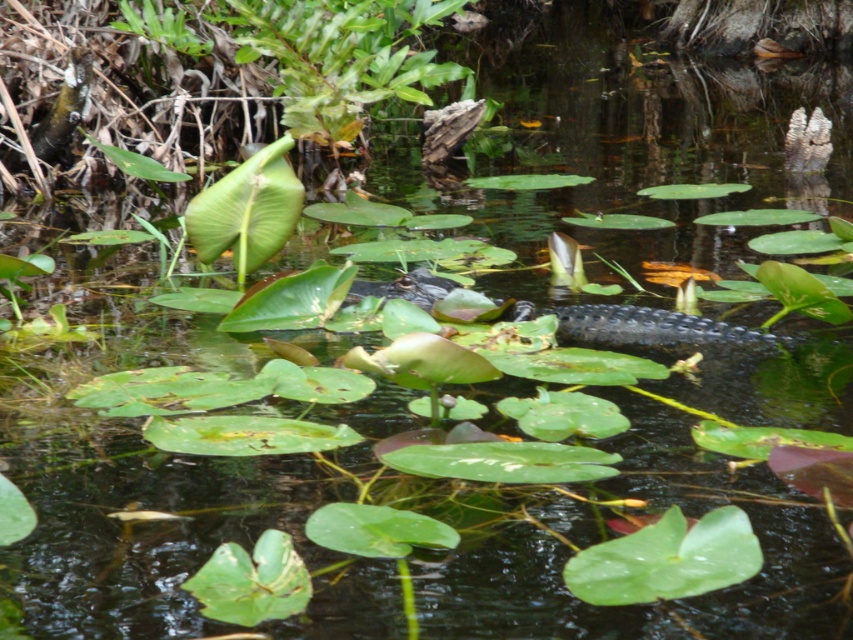
Consider the image. Between green leafy plant at upper left and dark green scaly crocodile at center, which one is positioned higher?

green leafy plant at upper left is above.

Does green leafy plant at upper left appear under dark green scaly crocodile at center?

Incorrect, green leafy plant at upper left is not positioned below dark green scaly crocodile at center.

Is point (363, 70) more distant than point (630, 340)?

Yes, it is behind point (630, 340).

Image resolution: width=853 pixels, height=640 pixels. What are the coordinates of `green leafy plant at upper left` in the screenshot? It's located at (341, 58).